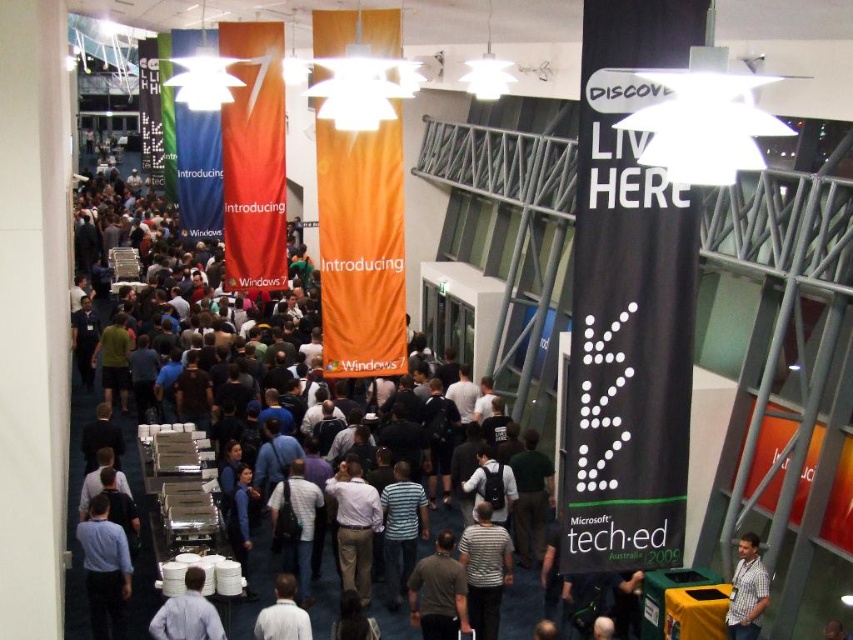
Between light blue shirt at lower left and dark gray shirt at center, which one is positioned higher?

light blue shirt at lower left is above.

Which is behind, point (126, 592) or point (466, 621)?

Positioned behind is point (126, 592).

Between point (117, 624) and point (447, 577), which one is positioned in front?

Positioned in front is point (447, 577).

Locate an element on the screen. This screenshot has height=640, width=853. light blue shirt at lower left is located at coordinates (103, 570).

This screenshot has height=640, width=853. In order to click on dark gray shirt at center in this screenshot , I will do `click(438, 593)`.

Is point (422, 570) behind point (746, 579)?

Yes, point (422, 570) is farther from viewer.

Find the location of a particular element. This screenshot has height=640, width=853. dark gray shirt at center is located at coordinates (438, 593).

In order to click on dark gray shirt at center in this screenshot , I will do `click(438, 593)`.

Is point (732, 637) in front of point (277, 589)?

No, it is not.

Which of these two, checkered shirt at center or white shirt at center, stands shorter?

white shirt at center is shorter.

In order to click on checkered shirt at center in this screenshot , I will do `click(747, 589)`.